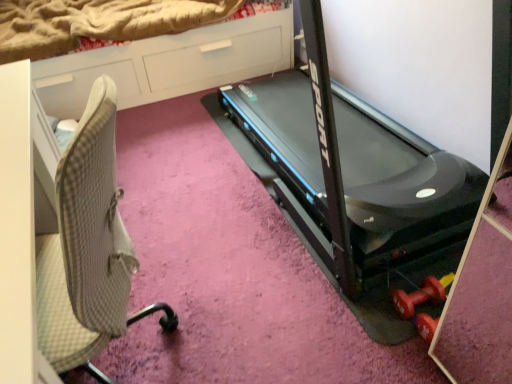
The width and height of the screenshot is (512, 384). Describe the element at coordinates (168, 64) in the screenshot. I see `white glossy dresser at upper left` at that location.

This screenshot has width=512, height=384. What do you see at coordinates (60, 236) in the screenshot? I see `beige fabric chair at left` at bounding box center [60, 236].

The height and width of the screenshot is (384, 512). Find the location of `white glossy dresser at upper left`. white glossy dresser at upper left is located at coordinates (168, 64).

From a real-world perspective, is beige fabric chair at left physically located above or below white glossy dresser at upper left?

Clearly, from a real-world perspective, beige fabric chair at left is above white glossy dresser at upper left.

Can you tell me how much beige fabric chair at left and white glossy dresser at upper left differ in facing direction?

There is a 114-degree angle between the facing directions of beige fabric chair at left and white glossy dresser at upper left.

This screenshot has height=384, width=512. In order to click on dresser on the left of beige fabric chair at left in this screenshot , I will do `click(168, 64)`.

Which of these two, beige fabric chair at left or white glossy dresser at upper left, is smaller?

beige fabric chair at left.

Is white glossy dresser at upper left thinner than beige fabric chair at left?

In fact, white glossy dresser at upper left might be wider than beige fabric chair at left.

From a real-world perspective, is white glossy dresser at upper left positioned over beige fabric chair at left based on gravity?

No, from a real-world perspective, white glossy dresser at upper left is not above beige fabric chair at left.

Is beige fabric chair at left completely or partially inside white glossy dresser at upper left?

No, beige fabric chair at left is not inside white glossy dresser at upper left.

Does point (245, 67) come in front of point (97, 214)?

No, (245, 67) is further to viewer.

Does beige fabric chair at left touch black plastic treadmill at center?

beige fabric chair at left is not next to black plastic treadmill at center, and they're not touching.

Is point (67, 175) positioned after point (434, 264)?

No, (67, 175) is closer to viewer.

Which object is closer to the camera, black plastic treadmill at center or beige fabric chair at left?

beige fabric chair at left.

From their relative heights in the image, would you say black plastic treadmill at center is taller or shorter than beige fabric chair at left?

Clearly, black plastic treadmill at center is taller compared to beige fabric chair at left.

Is black plastic treadmill at center outside of beige fabric chair at left?

black plastic treadmill at center lies outside beige fabric chair at left's area.

Could you tell me if white glossy dresser at upper left is turned towards black plastic treadmill at center?

Yes, white glossy dresser at upper left faces towards black plastic treadmill at center.

Is black plastic treadmill at center completely or partially inside white glossy dresser at upper left?

No, black plastic treadmill at center is not inside white glossy dresser at upper left.

Is white glossy dresser at upper left positioned in front of black plastic treadmill at center?

No, white glossy dresser at upper left is further to the viewer.

Locate an element on the screen. treadmill in front of the white glossy dresser at upper left is located at coordinates (399, 210).

From a real-world perspective, relative to white glossy dresser at upper left, is black plastic treadmill at center vertically above or below?

In terms of real-world spatial position, black plastic treadmill at center is above white glossy dresser at upper left.

Can you see black plastic treadmill at center touching white glossy dresser at upper left?

They are not placed beside each other.

Is black plastic treadmill at center closer to the viewer compared to white glossy dresser at upper left?

Yes, it is.

Is black plastic treadmill at center inside or outside of white glossy dresser at upper left?

black plastic treadmill at center is not inside white glossy dresser at upper left, it's outside.

Image resolution: width=512 pixels, height=384 pixels. I want to click on furniture in front of the white glossy dresser at upper left, so click(x=60, y=236).

I want to click on furniture located above the white glossy dresser at upper left (from a real-world perspective), so pyautogui.click(x=60, y=236).

When comparing their distances from white glossy dresser at upper left, does beige fabric chair at left or black plastic treadmill at center seem closer?

black plastic treadmill at center is positioned closer to the anchor white glossy dresser at upper left.

Which object lies nearer to the anchor point black plastic treadmill at center, beige fabric chair at left or white glossy dresser at upper left?

Based on the image, white glossy dresser at upper left appears to be nearer to black plastic treadmill at center.

Which object lies further to the anchor point black plastic treadmill at center, white glossy dresser at upper left or beige fabric chair at left?

Based on the image, beige fabric chair at left appears to be further to black plastic treadmill at center.

From the image, which object appears to be nearer to white glossy dresser at upper left, black plastic treadmill at center or beige fabric chair at left?

black plastic treadmill at center.

Estimate the real-world distances between objects in this image. Which object is further from beige fabric chair at left, white glossy dresser at upper left or black plastic treadmill at center?

Based on the image, white glossy dresser at upper left appears to be further to beige fabric chair at left.

Considering their positions, is black plastic treadmill at center positioned further to beige fabric chair at left than white glossy dresser at upper left?

white glossy dresser at upper left.

Where is `treadmill between beige fabric chair at left and white glossy dresser at upper left from front to back`? treadmill between beige fabric chair at left and white glossy dresser at upper left from front to back is located at coordinates (399, 210).